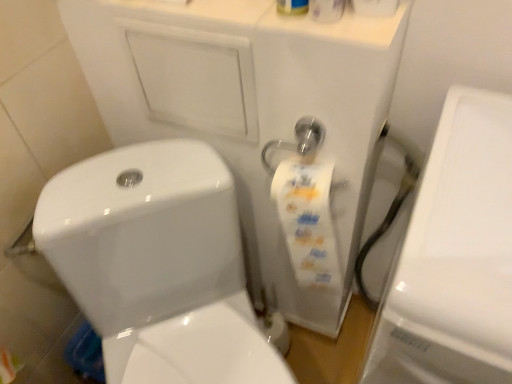
What do you see at coordinates (157, 264) in the screenshot?
I see `white glossy toilet at center` at bounding box center [157, 264].

At what (x,y) coordinates should I click in order to perform the action: click on white glossy toilet paper at upper center. Please return your answer as a coordinate pair (x, y). The image size is (512, 384). Looking at the image, I should click on (374, 7).

Find the location of a particular element. white glossy toilet at center is located at coordinates (157, 264).

Considering the positions of points (488, 320) and (95, 311), is point (488, 320) closer to camera compared to point (95, 311)?

Yes.

From the image's perspective, is white glossy porcelain at right above or below white glossy toilet at center?

Clearly, from the image's perspective, white glossy porcelain at right is above white glossy toilet at center.

Does white glossy porcelain at right lie in front of white glossy toilet at center?

Yes, white glossy porcelain at right is in front of white glossy toilet at center.

Based on their positions, is white glossy porcelain at right located to the left or right of white glossy toilet at center?

white glossy porcelain at right is positioned on white glossy toilet at center's right side.

Between white glossy porcelain at right and white glossy toilet paper at upper center, which one appears on the left side from the viewer's perspective?

Positioned to the left is white glossy toilet paper at upper center.

Between point (390, 330) and point (375, 12), which one is positioned in front?

Point (390, 330)

Which of these two, white glossy porcelain at right or white glossy toilet paper at upper center, stands taller?

white glossy porcelain at right is taller.

From a real-world perspective, which object stands above the other?

white glossy toilet paper at upper center, from a real-world perspective.

Considering the relative positions of white glossy toilet paper at upper center and white glossy toilet at center in the image provided, is white glossy toilet paper at upper center to the left or to the right of white glossy toilet at center?

white glossy toilet paper at upper center is to the right of white glossy toilet at center.

How distant is white glossy toilet paper at upper center from white glossy toilet at center?

white glossy toilet paper at upper center is 23.44 inches away from white glossy toilet at center.

Is white glossy toilet paper at upper center next to white glossy toilet at center and touching it?

No, white glossy toilet paper at upper center is not beside white glossy toilet at center.

Which of these two, white glossy toilet paper at upper center or white glossy toilet at center, is bigger?

white glossy toilet at center.

Based on the photo, from the image's perspective, which one is positioned lower, white glossy toilet at center or white glossy porcelain at right?

white glossy toilet at center appears lower in the image.

Between white glossy toilet at center and white glossy porcelain at right, which one is positioned behind?

white glossy toilet at center is further from the camera.

Locate an element on the screen. This screenshot has width=512, height=384. toilet that is on the left side of white glossy porcelain at right is located at coordinates (157, 264).

From a real-world perspective, relative to white glossy porcelain at right, is white glossy toilet at center vertically above or below?

white glossy toilet at center is below white glossy porcelain at right.

Is white glossy toilet paper at upper center facing away from white glossy porcelain at right?

No, white glossy porcelain at right is not at the back of white glossy toilet paper at upper center.

Is white glossy toilet paper at upper center positioned before white glossy porcelain at right?

No, it is not.

Locate an element on the screen. The width and height of the screenshot is (512, 384). porcelain on the right of the white glossy toilet paper at upper center is located at coordinates (455, 256).

From the image's perspective, which one is positioned higher, white glossy toilet at center or white glossy toilet paper at upper center?

From the image's view, white glossy toilet paper at upper center is above.

Locate an element on the screen. The image size is (512, 384). toilet paper located on the right of white glossy toilet at center is located at coordinates (374, 7).

Does white glossy toilet at center have a lesser height compared to white glossy toilet paper at upper center?

In fact, white glossy toilet at center may be taller than white glossy toilet paper at upper center.

Is point (46, 187) closer to viewer compared to point (361, 12)?

No.

Image resolution: width=512 pixels, height=384 pixels. In the image, there is a white glossy porcelain at right. Find the location of `toilet below it (from the image's perspective)`. toilet below it (from the image's perspective) is located at coordinates (157, 264).

Where is `toilet paper above the white glossy porcelain at right (from the image's perspective)`? The height and width of the screenshot is (384, 512). toilet paper above the white glossy porcelain at right (from the image's perspective) is located at coordinates (374, 7).

Looking at the image, which one is located further to white glossy toilet paper at upper center, white glossy toilet at center or white glossy porcelain at right?

Among the two, white glossy toilet at center is located further to white glossy toilet paper at upper center.

Based on their spatial positions, is white glossy toilet at center or white glossy toilet paper at upper center further from white glossy porcelain at right?

Among the two, white glossy toilet at center is located further to white glossy porcelain at right.

Looking at the image, which one is located further to white glossy toilet at center, white glossy toilet paper at upper center or white glossy porcelain at right?

Based on the image, white glossy toilet paper at upper center appears to be further to white glossy toilet at center.

From the image, which object appears to be farther from white glossy toilet paper at upper center, white glossy porcelain at right or white glossy toilet at center?

white glossy toilet at center is further to white glossy toilet paper at upper center.

Based on their spatial positions, is white glossy porcelain at right or white glossy toilet paper at upper center closer to white glossy toilet at center?

white glossy porcelain at right lies closer to white glossy toilet at center than the other object.

Which object lies nearer to the anchor point white glossy porcelain at right, white glossy toilet paper at upper center or white glossy toilet at center?

Among the two, white glossy toilet paper at upper center is located nearer to white glossy porcelain at right.

You are a GUI agent. You are given a task and a screenshot of the screen. Output one action in this format:
    pyautogui.click(x=<x>, y=<y>)
    Task: Click on the porcelain between white glossy toilet paper at upper center and white glossy toilet at center vertically
    
    Given the screenshot: What is the action you would take?
    pyautogui.click(x=455, y=256)